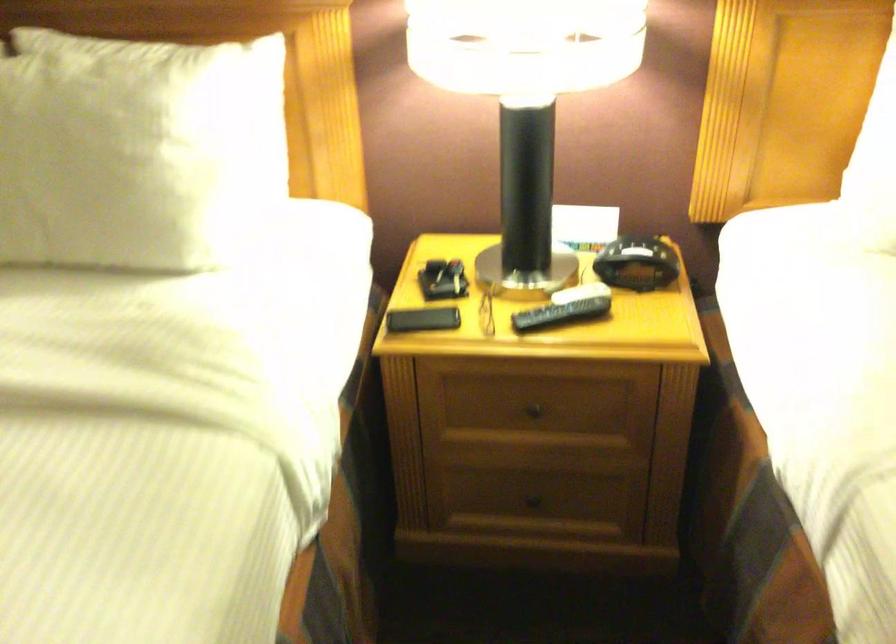
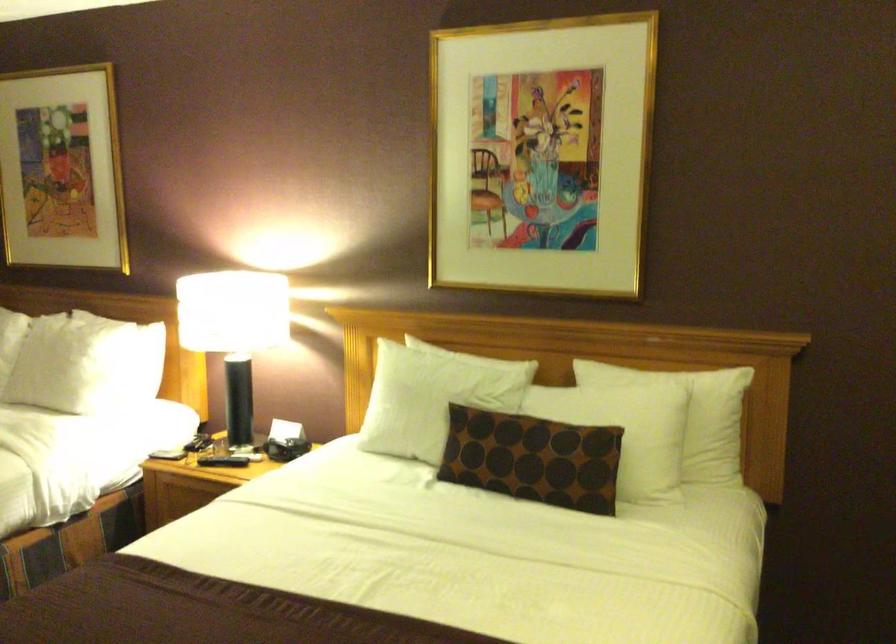
Question: I am providing you with two images of the same scene from different viewpoints. After the viewpoint changes to image2, which objects are now occluded?

Choices:
 (A) brown patterned pillow
 (B) drawer knob
 (C) black electric plug
 (D) black remote control

Answer: (B)